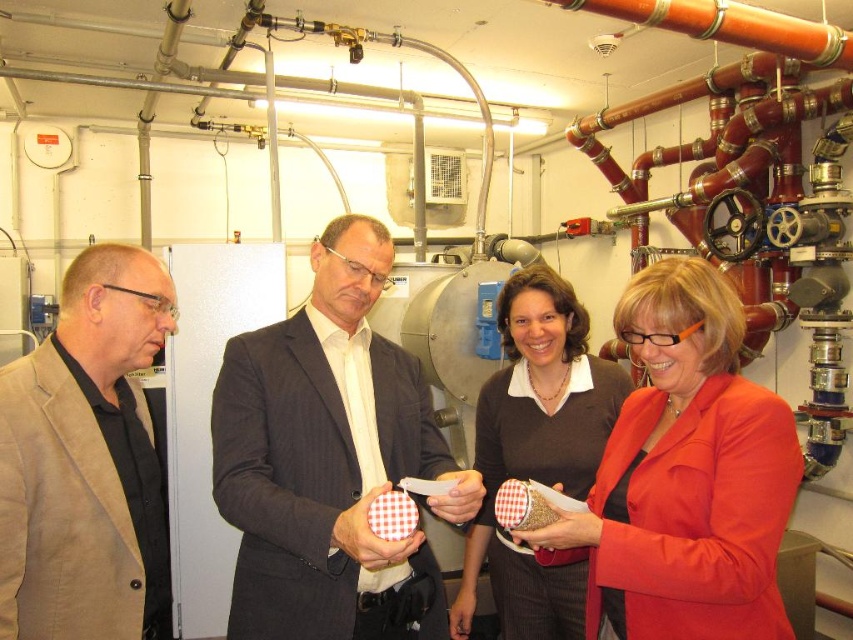
Question: Is beige fabric jacket at left positioned before matte brown sweater at center?

Choices:
 (A) no
 (B) yes

Answer: (B)

Question: Is dark gray pinstripe suit at center positioned at the back of matte brown sweater at center?

Choices:
 (A) no
 (B) yes

Answer: (A)

Question: Which of the following is the closest to the observer?

Choices:
 (A) (375, 465)
 (B) (703, 410)
 (C) (483, 476)

Answer: (B)

Question: Does dark gray pinstripe suit at center appear on the right side of beige fabric jacket at left?

Choices:
 (A) yes
 (B) no

Answer: (A)

Question: Which point appears farthest from the camera in this image?

Choices:
 (A) (112, 324)
 (B) (492, 420)

Answer: (B)

Question: Among these objects, which one is farthest from the camera?

Choices:
 (A) beige fabric jacket at left
 (B) dark gray pinstripe suit at center
 (C) matte brown sweater at center
 (D) matte red blazer at center

Answer: (C)